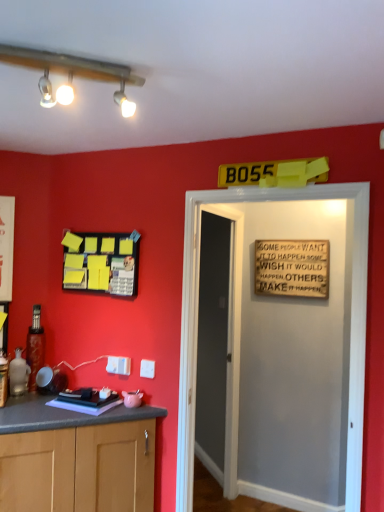
Question: Is wooden signboard at center, which is the 1th door in front-to-back order, facing away from yellow matte bulletin board at upper left?

Choices:
 (A) no
 (B) yes

Answer: (A)

Question: Does wooden signboard at center, the 2th door viewed from the back, appear on the left side of yellow matte bulletin board at upper left?

Choices:
 (A) yes
 (B) no

Answer: (B)

Question: From the image's perspective, is wooden signboard at center, the 2th door viewed from the back, below yellow matte bulletin board at upper left?

Choices:
 (A) no
 (B) yes

Answer: (B)

Question: Is wooden signboard at center, which is the 1th door in front-to-back order, bigger than yellow matte bulletin board at upper left?

Choices:
 (A) yes
 (B) no

Answer: (A)

Question: Is yellow matte bulletin board at upper left a part of wooden signboard at center, the 2th door viewed from the back?

Choices:
 (A) yes
 (B) no

Answer: (B)

Question: Is yellow matte bulletin board at upper left bigger or smaller than wooden signboard at center, the 2th door viewed from the back?

Choices:
 (A) big
 (B) small

Answer: (B)

Question: From the image's perspective, is yellow matte bulletin board at upper left located above or below wooden signboard at center, which is the 1th door in front-to-back order?

Choices:
 (A) above
 (B) below

Answer: (A)

Question: Is yellow matte bulletin board at upper left wider or thinner than wooden signboard at center, which is the 1th door in front-to-back order?

Choices:
 (A) wide
 (B) thin

Answer: (B)

Question: In terms of height, does yellow matte bulletin board at upper left look taller or shorter compared to wooden signboard at center, which is the 1th door in front-to-back order?

Choices:
 (A) tall
 (B) short

Answer: (B)

Question: Is smooth gray door at center, the second door in the front-to-back sequence, wider or thinner than yellow matte bulletin board at upper left?

Choices:
 (A) thin
 (B) wide

Answer: (B)

Question: Considering the positions of point (223, 265) and point (91, 260), is point (223, 265) closer or farther from the camera than point (91, 260)?

Choices:
 (A) farther
 (B) closer

Answer: (A)

Question: Considering the positions of smooth gray door at center, positioned as the 1th door in back-to-front order, and yellow matte bulletin board at upper left in the image, is smooth gray door at center, positioned as the 1th door in back-to-front order, bigger or smaller than yellow matte bulletin board at upper left?

Choices:
 (A) big
 (B) small

Answer: (A)

Question: From the image's perspective, is smooth gray door at center, the second door in the front-to-back sequence, positioned above or below yellow matte bulletin board at upper left?

Choices:
 (A) below
 (B) above

Answer: (A)

Question: From the image's perspective, relative to yellow matte bulletin board at upper left, is wooden signboard at center, the 2th door viewed from the back, above or below?

Choices:
 (A) above
 (B) below

Answer: (B)

Question: Based on their positions, is wooden signboard at center, the 2th door viewed from the back, located to the left or right of yellow matte bulletin board at upper left?

Choices:
 (A) right
 (B) left

Answer: (A)